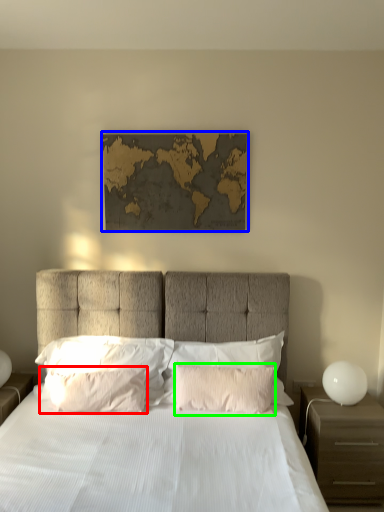
Question: Based on their relative distances, which object is nearer to pillow (highlighted by a red box)? Choose from picture frame (highlighted by a blue box) and pillow (highlighted by a green box).

Choices:
 (A) picture frame
 (B) pillow

Answer: (B)